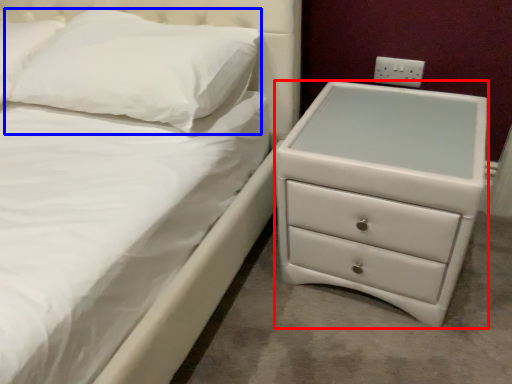
Question: Which point is closer to the camera, chest of drawers (highlighted by a red box) or pillow (highlighted by a blue box)?

Choices:
 (A) chest of drawers
 (B) pillow

Answer: (A)